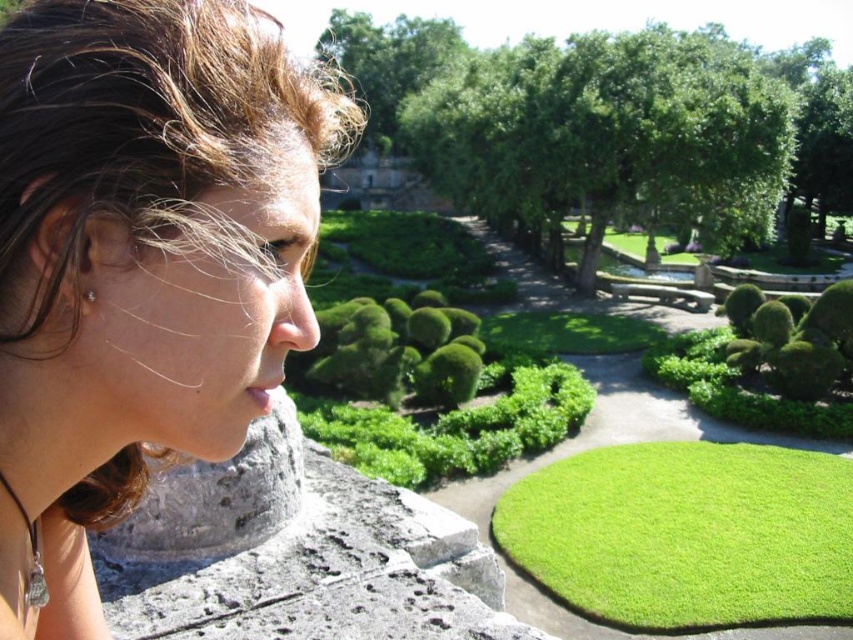
Question: Does brown hair at upper left appear over green bushy hedge at center?

Choices:
 (A) yes
 (B) no

Answer: (A)

Question: Is green bushy hedge at center to the left of silver metallic earring at left from the viewer's perspective?

Choices:
 (A) yes
 (B) no

Answer: (A)

Question: Which point appears closest to the camera in this image?

Choices:
 (A) (813, 324)
 (B) (45, 387)
 (C) (90, 298)

Answer: (C)

Question: Which object appears closest to the camera in this image?

Choices:
 (A) green bushy hedge at center
 (B) brown hair at upper left
 (C) silver metallic earring at left

Answer: (B)

Question: Which of the following is the farthest from the observer?

Choices:
 (A) brown hair at upper left
 (B) green leafy hedge at lower right

Answer: (B)

Question: Can you confirm if green bushy hedge at center is wider than silver metallic earring at left?

Choices:
 (A) no
 (B) yes

Answer: (B)